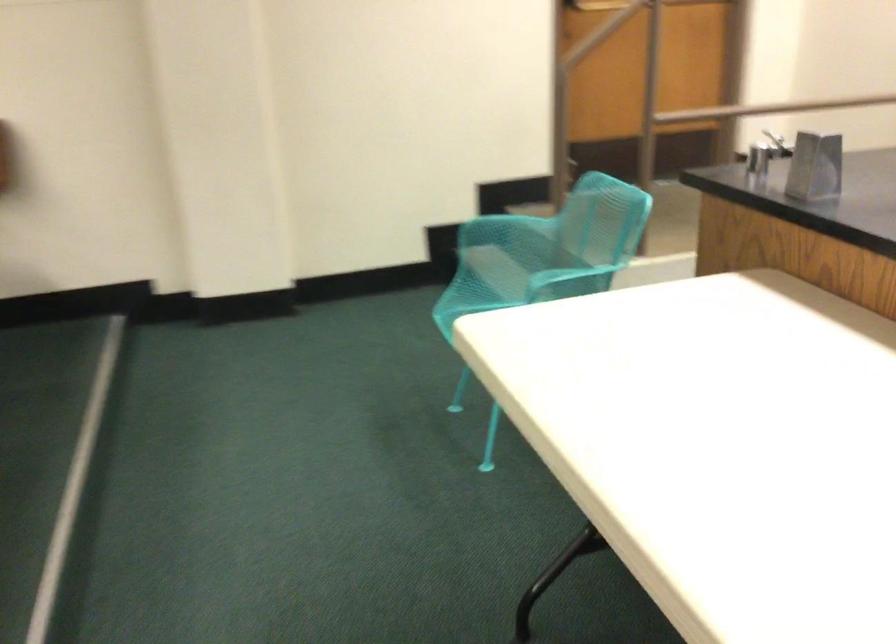
The height and width of the screenshot is (644, 896). What do you see at coordinates (778, 144) in the screenshot?
I see `a faucet handle` at bounding box center [778, 144].